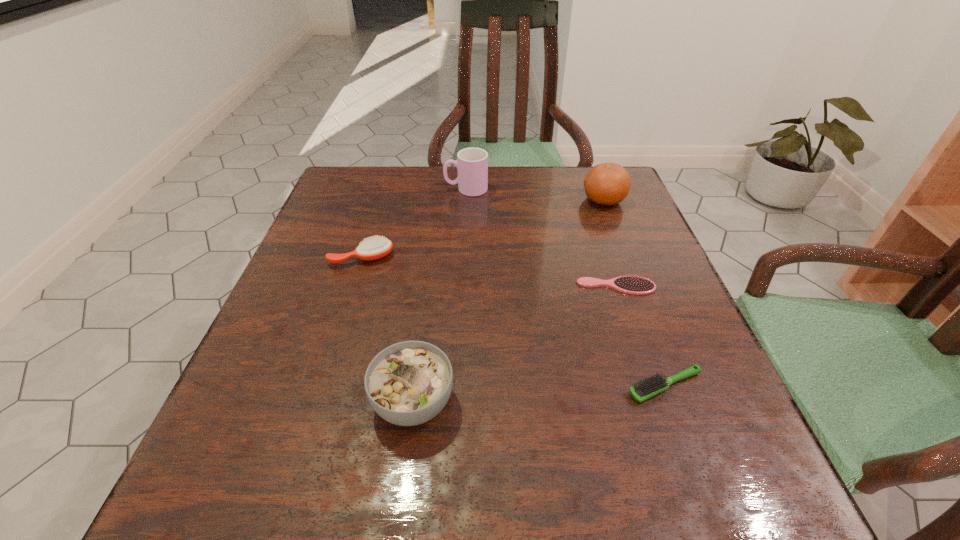
At what (x,y) coordinates should I click in order to perform the action: click on clementine that is positioned at the right edge. Please return your answer as a coordinate pair (x, y). The height and width of the screenshot is (540, 960). Looking at the image, I should click on (608, 183).

Where is `object that is at the far right corner`? object that is at the far right corner is located at coordinates (608, 183).

What are the coordinates of `vacant point at the far edge` in the screenshot? It's located at (554, 166).

In the image, there is a desktop. In order to click on free space at the left edge in this screenshot , I will do `click(298, 397)`.

Where is `vacant space at the right edge of the desktop`? This screenshot has height=540, width=960. vacant space at the right edge of the desktop is located at coordinates (686, 400).

The image size is (960, 540). In the image, there is a desktop. Identify the location of free space at the far left corner. (362, 197).

Where is `vacant space at the near left corner`? vacant space at the near left corner is located at coordinates (255, 511).

In the image, there is a desktop. Where is `vacant space at the far right corner`? The image size is (960, 540). vacant space at the far right corner is located at coordinates (568, 172).

In the image, there is a desktop. In order to click on free space at the near right corner in this screenshot , I will do `click(725, 511)`.

Locate an element on the screen. This screenshot has height=540, width=960. vacant space in between the cup and the leftmost hairbrush is located at coordinates (414, 224).